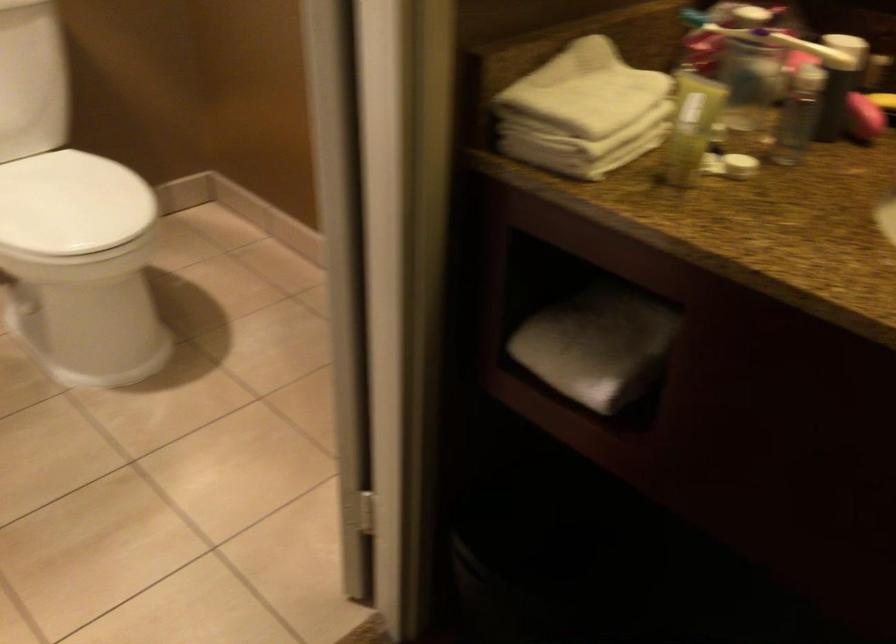
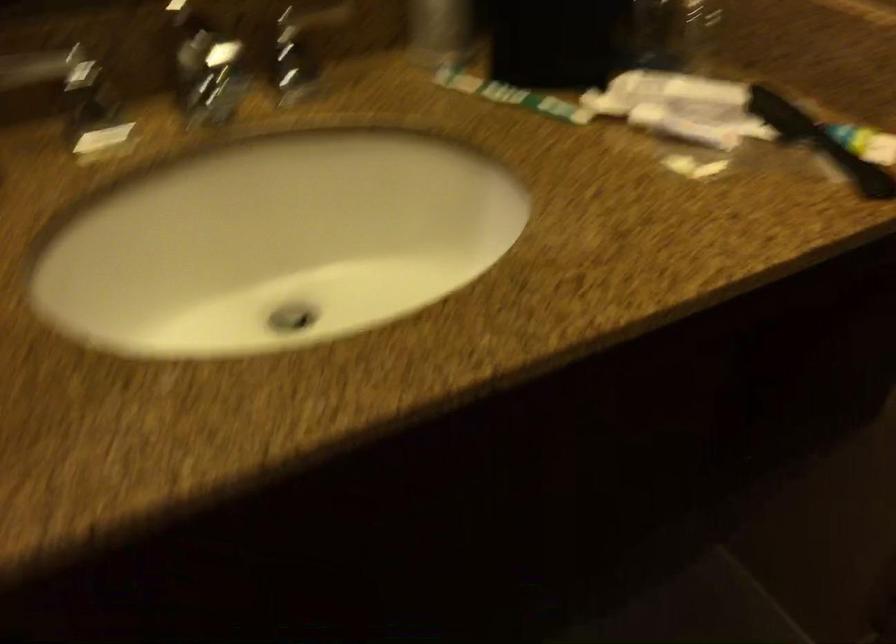
How did the camera likely rotate?

The camera's rotation is toward right-down.